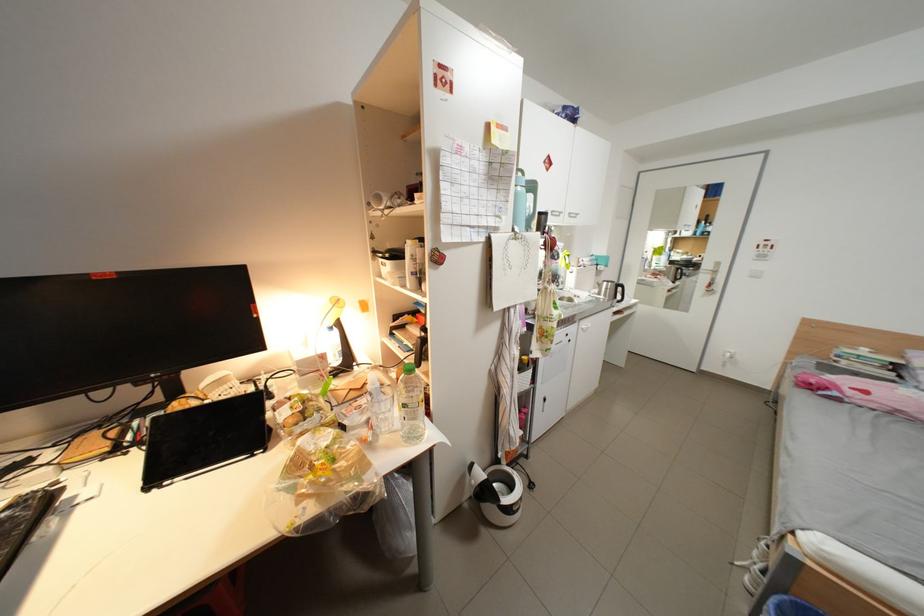
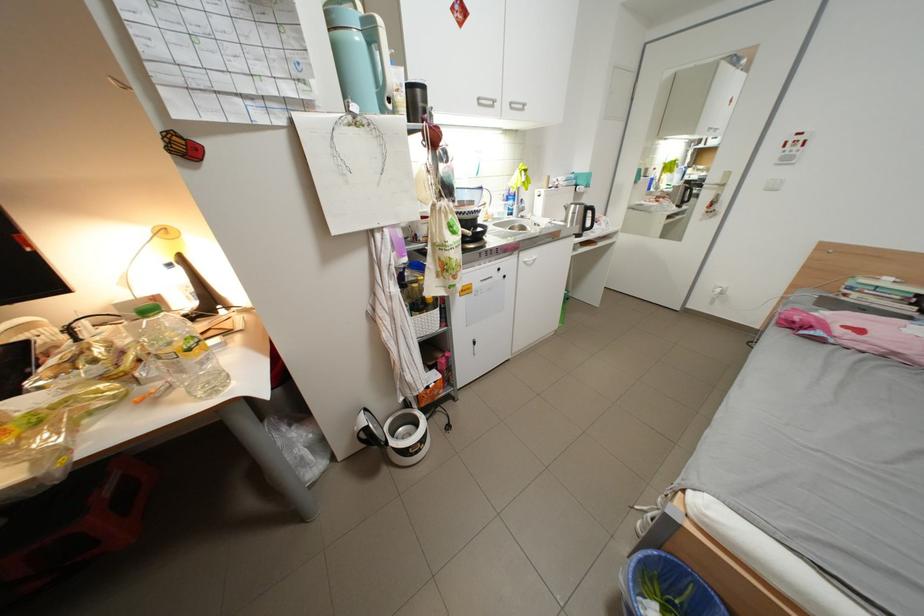
Question: The first image is from the beginning of the video and the second image is from the end. How did the camera likely rotate when shooting the video?

Choices:
 (A) Left
 (B) Right
 (C) Up
 (D) Down

Answer: (D)